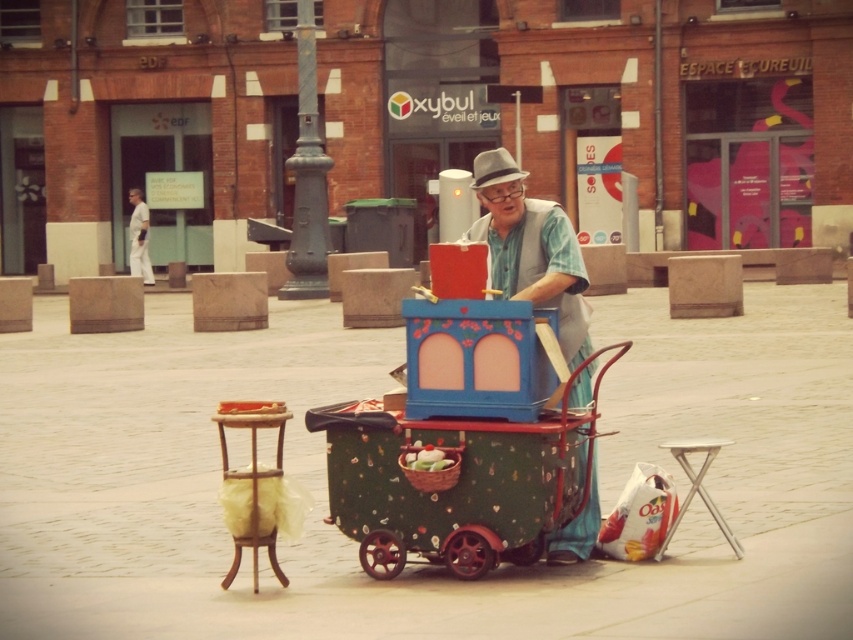
Is green painted wood cart at center to the left of gray felt hat at center from the viewer's perspective?

Yes, green painted wood cart at center is to the left of gray felt hat at center.

Is green painted wood cart at center thinner than gray felt hat at center?

No, green painted wood cart at center is not thinner than gray felt hat at center.

Is point (331, 426) more distant than point (500, 157)?

No, (331, 426) is in front of (500, 157).

The image size is (853, 640). Find the location of `green painted wood cart at center`. green painted wood cart at center is located at coordinates (460, 448).

The image size is (853, 640). Identify the location of matte blue cart at center. (535, 259).

Does matte blue cart at center have a lesser width compared to gray felt hat at center?

Yes.

Image resolution: width=853 pixels, height=640 pixels. I want to click on matte blue cart at center, so click(x=535, y=259).

Can you confirm if green painted wood cart at center is positioned to the right of green woven basket at center?

Yes, green painted wood cart at center is to the right of green woven basket at center.

Is point (409, 524) closer to camera compared to point (428, 456)?

No, it is behind (428, 456).

Where is `green painted wood cart at center`? green painted wood cart at center is located at coordinates (460, 448).

Identify the location of green painted wood cart at center. (460, 448).